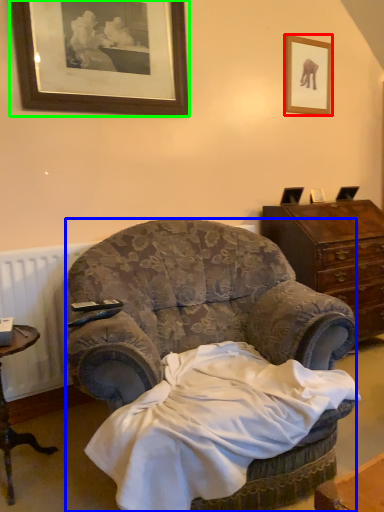
Question: Which object is positioned closest to picture frame (highlighted by a red box)? Select from chair (highlighted by a blue box) and picture frame (highlighted by a green box).

Choices:
 (A) chair
 (B) picture frame

Answer: (B)